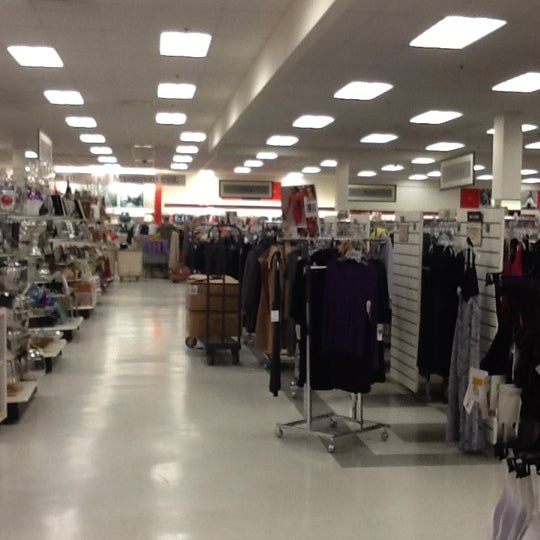
Locate an element on the screen. The image size is (540, 540). bottom shelf is located at coordinates (22, 398), (54, 353), (76, 324), (89, 306).